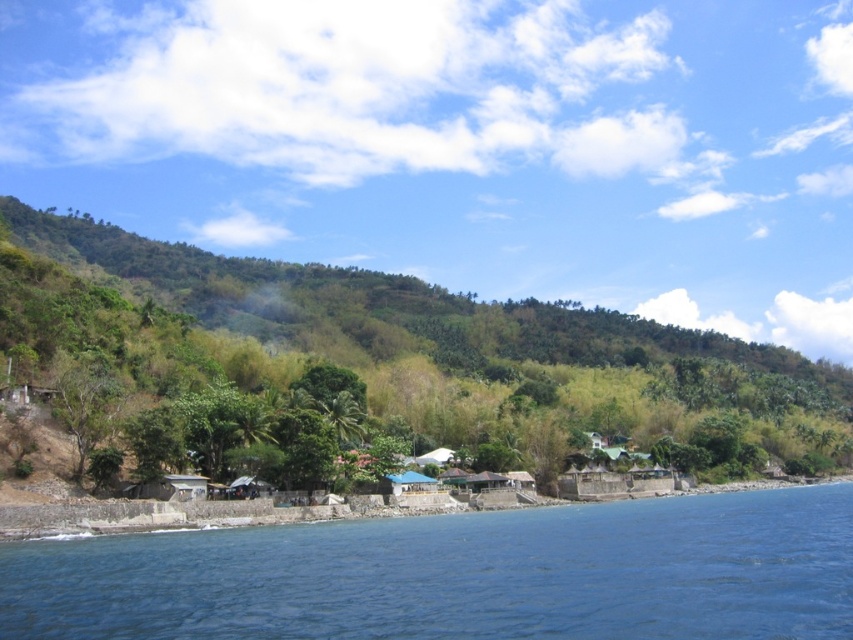
You are standing on the rocky shoreline and see the blue water at lower left and the green leafy hillside at center. Which object is positioned to the left of the other?

The blue water at lower left is to the left of the green leafy hillside at center.

You are standing at the edge of the rocky shoreline looking towards the structures. There are two points marked on the image. Which point, point (102, 627) or point (265, 280), is closer to your current position?

→ Point (102, 627) is closer to the viewer than point (265, 280), so it is closer to your current position.